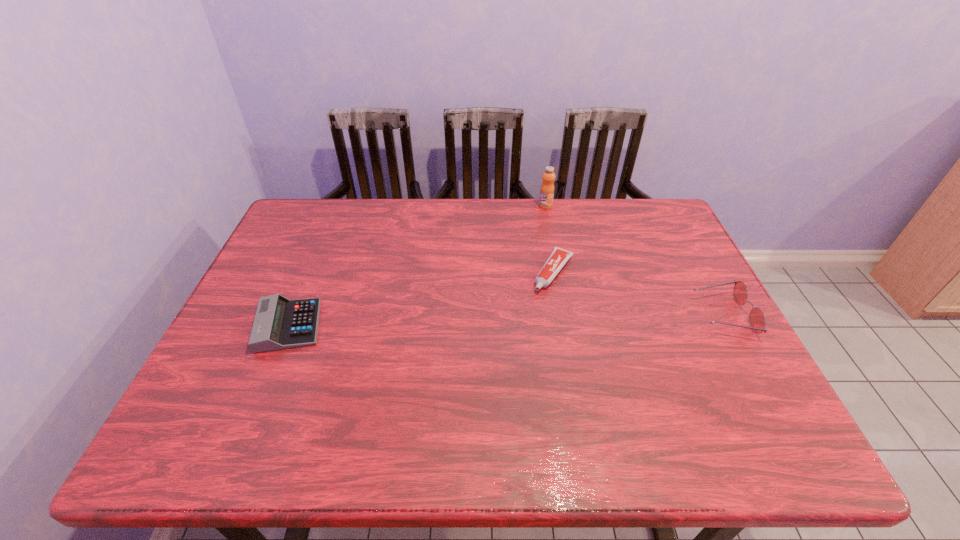
Find the location of a particular element. The width and height of the screenshot is (960, 540). free point that satisfies the following two spatial constraints: 1. on the back side of the tallest object; 2. on the left side of the toothpaste is located at coordinates (541, 206).